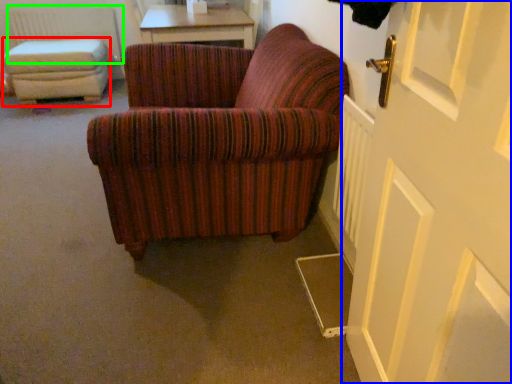
Question: Which is farther away from stool (highlighted by a red box)? door (highlighted by a blue box) or radiator (highlighted by a green box)?

Choices:
 (A) door
 (B) radiator

Answer: (A)